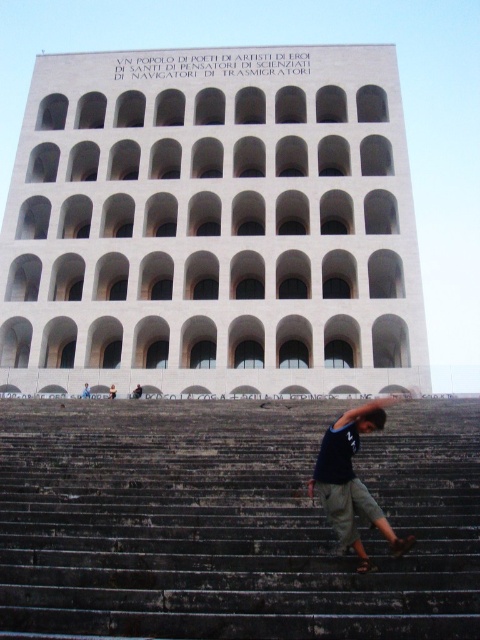
You are a visitor standing in front of the building and see the dark gray concrete stairs at center and the dark blue shirt at lower center. Which object is taller?

The dark gray concrete stairs at center is taller than the dark blue shirt at lower center.